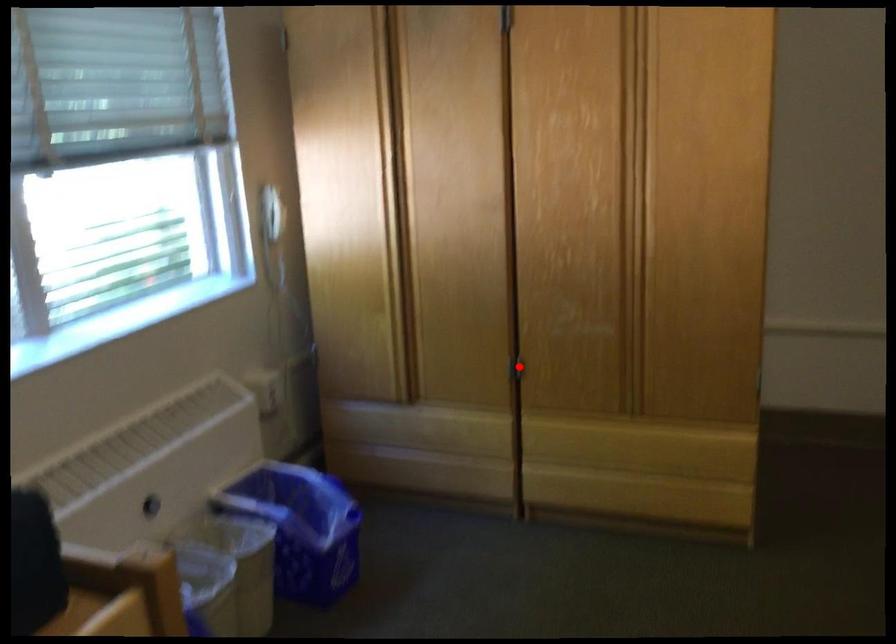
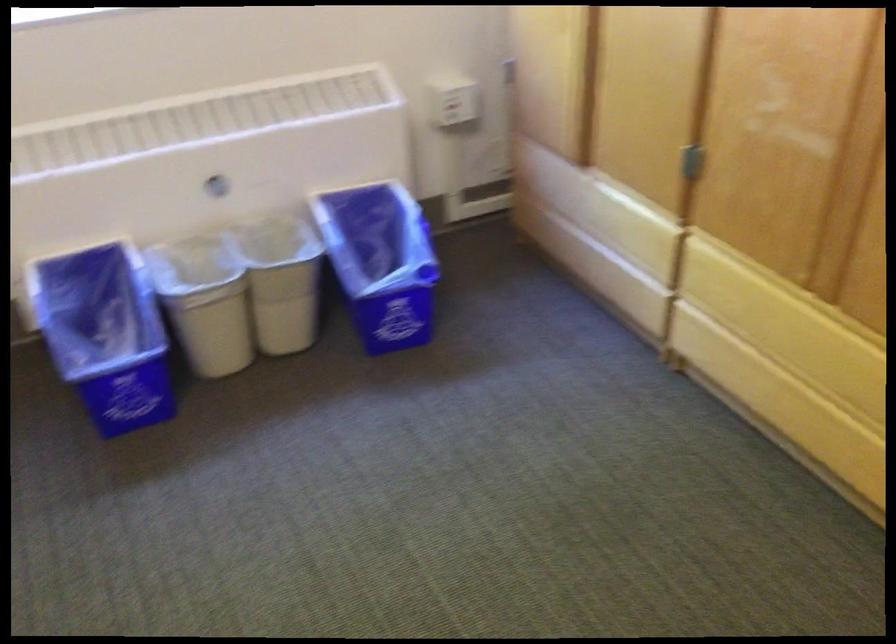
In the second image, find the point that corresponds to the highlighted location in the first image.

(691, 162)